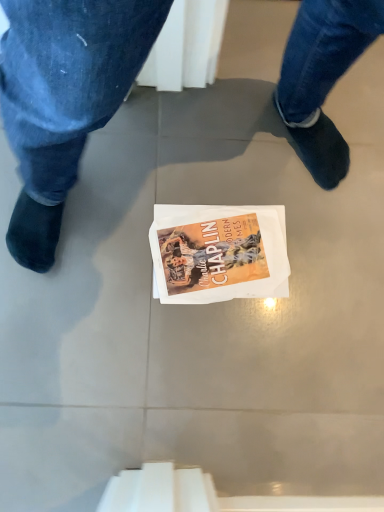
This screenshot has height=512, width=384. I want to click on blank space situated above orange matte paper at center (from a real-world perspective), so click(x=215, y=243).